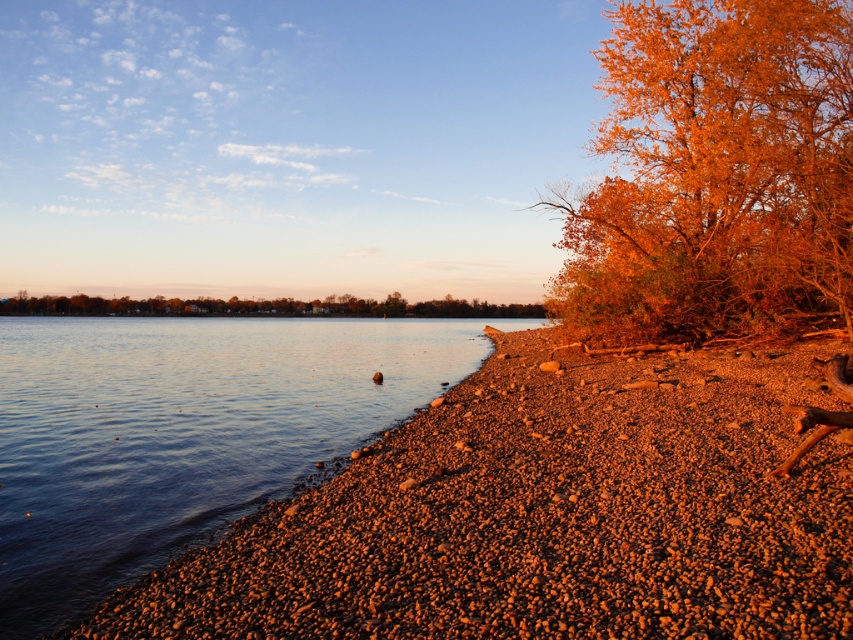
Question: Is orange leafy tree at right positioned before orange matte tree at center?

Choices:
 (A) yes
 (B) no

Answer: (A)

Question: Is smooth water at lower left wider than orange leafy tree at right?

Choices:
 (A) yes
 (B) no

Answer: (A)

Question: Is smooth water at lower left to the left of orange leafy tree at right from the viewer's perspective?

Choices:
 (A) no
 (B) yes

Answer: (B)

Question: Which object appears closest to the camera in this image?

Choices:
 (A) orange leafy tree at right
 (B) orange matte tree at center
 (C) smooth water at lower left

Answer: (C)

Question: Among these points, which one is nearest to the camera?

Choices:
 (A) (680, 211)
 (B) (403, 339)
 (C) (519, 307)

Answer: (A)

Question: Which point is farther from the camera taking this photo?

Choices:
 (A) (727, 180)
 (B) (438, 339)

Answer: (B)